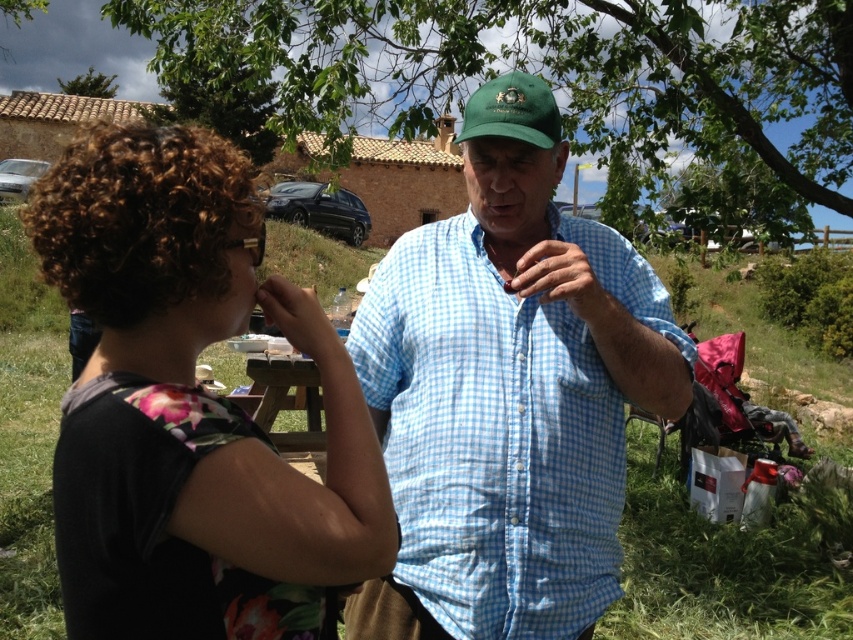
Question: In this image, where is floral fabric shirt at left located relative to green fabric baseball cap at center?

Choices:
 (A) above
 (B) below

Answer: (B)

Question: Does green leafy tree at upper center appear over green fabric baseball cap at center?

Choices:
 (A) yes
 (B) no

Answer: (A)

Question: Based on their relative distances, which object is farther from the blue checkered shirt at center?

Choices:
 (A) floral fabric shirt at left
 (B) green leafy tree at upper left
 (C) wooden picnic table at center
 (D) green grass at center

Answer: (B)

Question: Does floral fabric shirt at left appear on the right side of green leafy tree at upper left?

Choices:
 (A) yes
 (B) no

Answer: (A)

Question: Which point is closer to the camera taking this photo?

Choices:
 (A) (676, 604)
 (B) (314, 387)
 (C) (236, 522)

Answer: (C)

Question: Among these objects, which one is farthest from the camera?

Choices:
 (A) floral fabric shirt at left
 (B) green leafy tree at upper left
 (C) green leafy tree at upper center

Answer: (B)